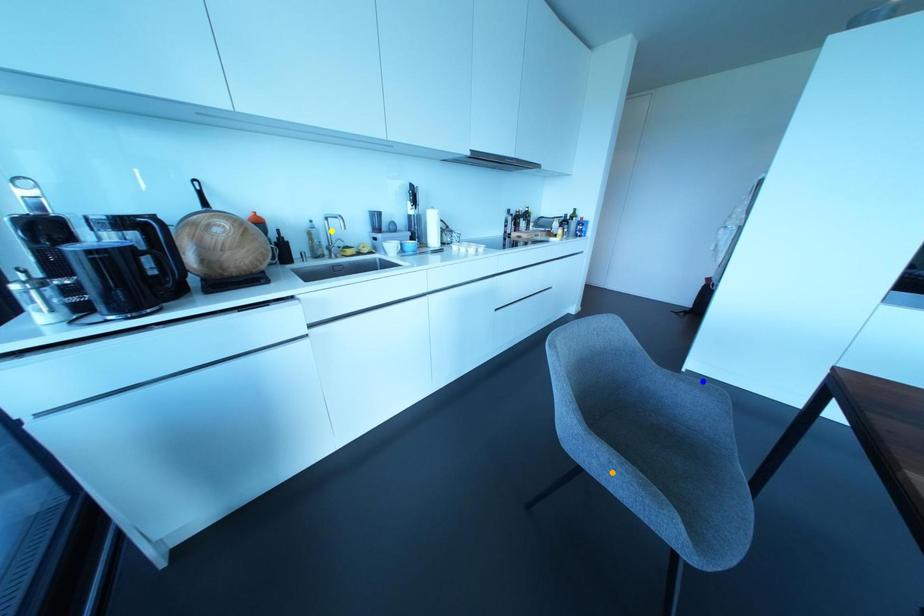
Order these from nearest to farthest:
blue point | orange point | yellow point

orange point → yellow point → blue point